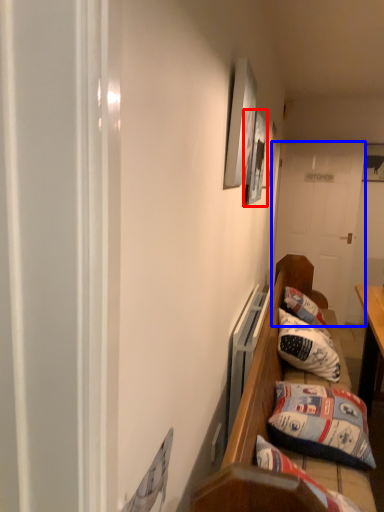
Question: Which point is closer to the camera, picture frame (highlighted by a red box) or door (highlighted by a blue box)?

Choices:
 (A) picture frame
 (B) door

Answer: (A)